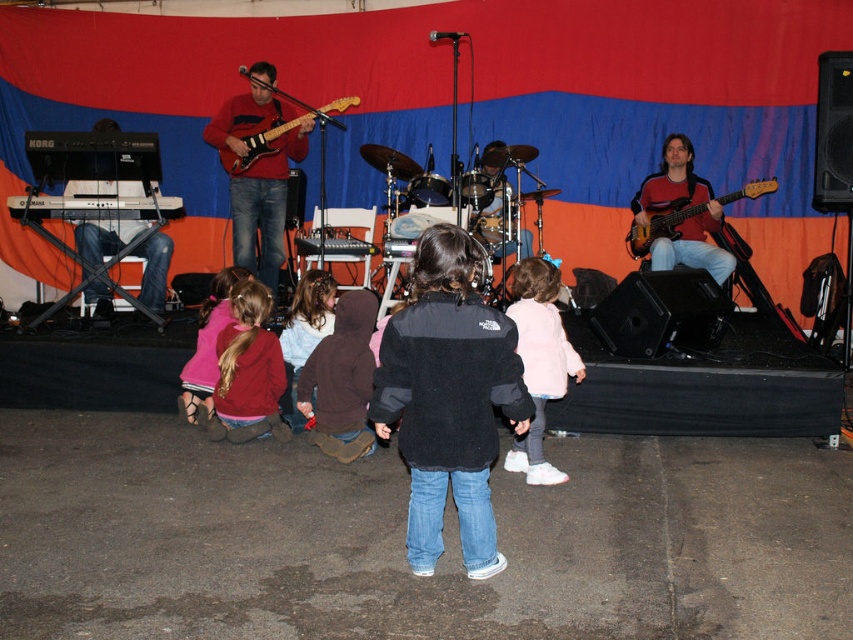
You are standing at the position of the viewer and want to hand a pale pink fleece jacket at center to a friend who is 1.5 meters away from you. Can you reach them without moving?

The distance between the viewer and the pale pink fleece jacket at center is 4.12 meters, which is greater than the 1.5 meters you can reach. Therefore, you cannot reach your friend without moving closer.

You are a stagehand who needs to move a 1.5 meter long ladder from the backstage to the front of the stage. There is a brown suede jacket at center and a matte electric guitar at center on the stage. Can you safely move the ladder between them without hitting either?

The brown suede jacket at center and matte electric guitar at center are 1.82 meters apart. Since the ladder is 1.5 meters long, it can fit between them as the distance is greater than the ladder length.